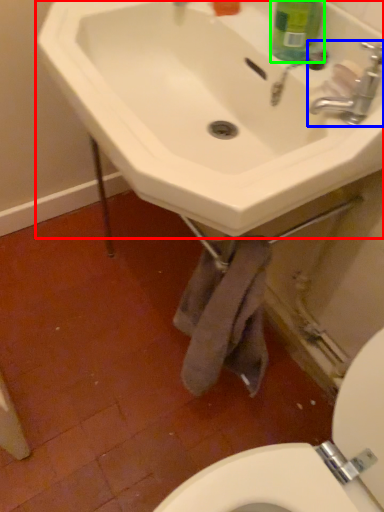
Question: Considering the real-world distances, which object is farthest from sink (highlighted by a red box)? tap (highlighted by a blue box) or cleaning product (highlighted by a green box)?

Choices:
 (A) tap
 (B) cleaning product

Answer: (A)